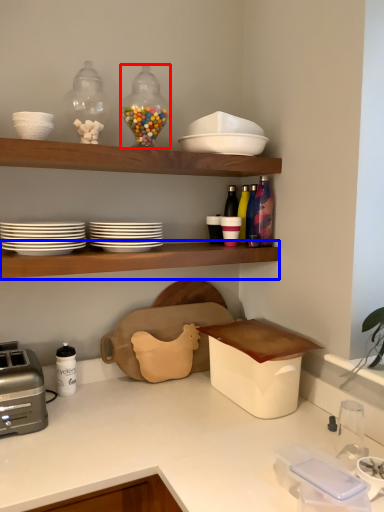
Question: Which of the following is the closest to the observer, tableware (highlighted by a red box) or shelf (highlighted by a blue box)?

Choices:
 (A) tableware
 (B) shelf

Answer: (B)